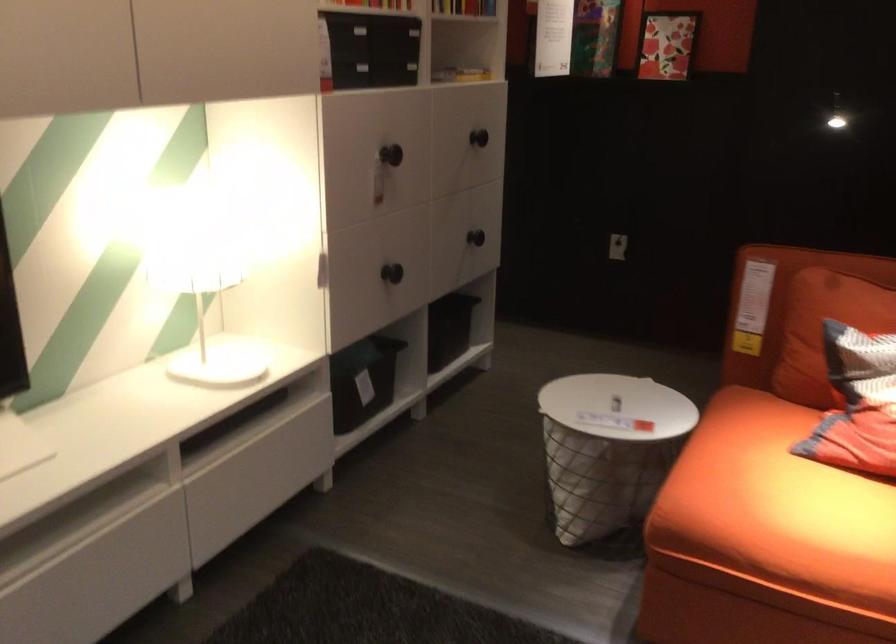
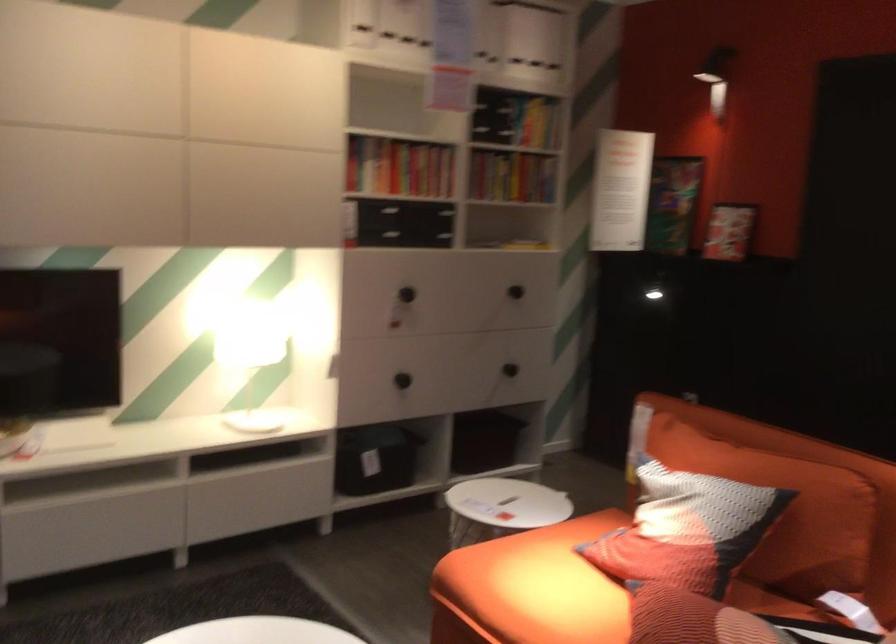
In the second image, find the point that corresponds to (367,384) in the first image.

(375, 459)